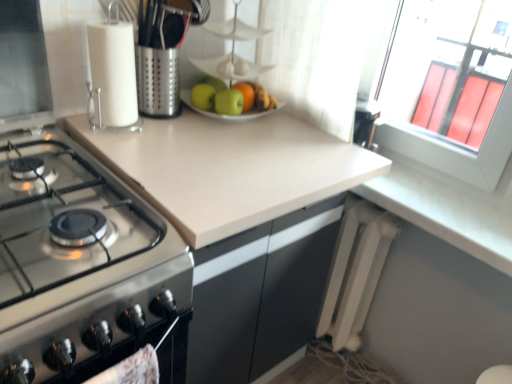
Locate an element on the screen. The width and height of the screenshot is (512, 384). vacant area on top of white matte counter top at lower right (from a real-world perspective) is located at coordinates (454, 194).